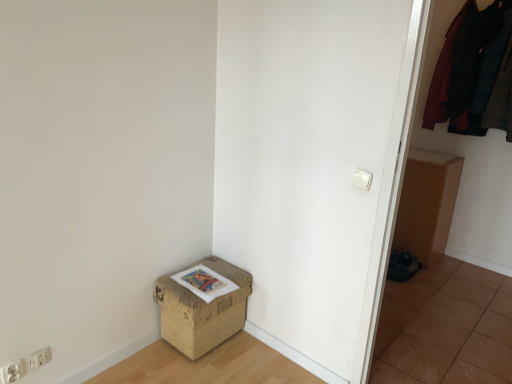
Question: Should I look upward or downward to see brown cardboard box at lower left?

Choices:
 (A) up
 (B) down

Answer: (B)

Question: Can you confirm if brown tile at lower right is thinner than white plastic electric outlet at lower left, the 2th electric outlet positioned from the back?

Choices:
 (A) no
 (B) yes

Answer: (A)

Question: Is brown tile at lower right aimed at white plastic electric outlet at lower left, the 2th electric outlet positioned from the back?

Choices:
 (A) no
 (B) yes

Answer: (A)

Question: Can you confirm if brown tile at lower right is bigger than white plastic electric outlet at lower left, the 2th electric outlet positioned from the right?

Choices:
 (A) yes
 (B) no

Answer: (A)

Question: Is brown tile at lower right placed right next to white plastic electric outlet at lower left, which appears as the 1th electric outlet when viewed from the front?

Choices:
 (A) yes
 (B) no

Answer: (B)

Question: Is brown tile at lower right completely or partially outside of white plastic electric outlet at lower left, which appears as the 1th electric outlet when viewed from the front?

Choices:
 (A) yes
 (B) no

Answer: (A)

Question: Can you confirm if brown tile at lower right is smaller than white plastic electric outlet at lower left, the 2th electric outlet positioned from the right?

Choices:
 (A) yes
 (B) no

Answer: (B)

Question: From a real-world perspective, is brown tile at lower right over white plastic electric outlet at lower left, which is the 2th electric outlet from left to right?

Choices:
 (A) no
 (B) yes

Answer: (A)

Question: Can you confirm if brown tile at lower right is taller than white plastic electric outlet at lower left, positioned as the 1th electric outlet in back-to-front order?

Choices:
 (A) yes
 (B) no

Answer: (B)

Question: From the image's perspective, is brown tile at lower right over white plastic electric outlet at lower left, positioned as the second electric outlet in front-to-back order?

Choices:
 (A) no
 (B) yes

Answer: (A)

Question: Is the depth of brown tile at lower right greater than that of white plastic electric outlet at lower left, positioned as the second electric outlet in front-to-back order?

Choices:
 (A) no
 (B) yes

Answer: (A)

Question: Does brown tile at lower right touch white plastic electric outlet at lower left, positioned as the 1th electric outlet in back-to-front order?

Choices:
 (A) yes
 (B) no

Answer: (B)

Question: From a real-world perspective, is brown tile at lower right beneath white plastic electric outlet at lower left, positioned as the 1th electric outlet in back-to-front order?

Choices:
 (A) yes
 (B) no

Answer: (A)

Question: Considering the relative sizes of white plastic electric outlet at lower left, which appears as the 1th electric outlet when viewed from the front, and dark woolen sweater at upper right, marked as the 1th clothing in a left-to-right arrangement, in the image provided, is white plastic electric outlet at lower left, which appears as the 1th electric outlet when viewed from the front, shorter than dark woolen sweater at upper right, marked as the 1th clothing in a left-to-right arrangement,?

Choices:
 (A) yes
 (B) no

Answer: (A)